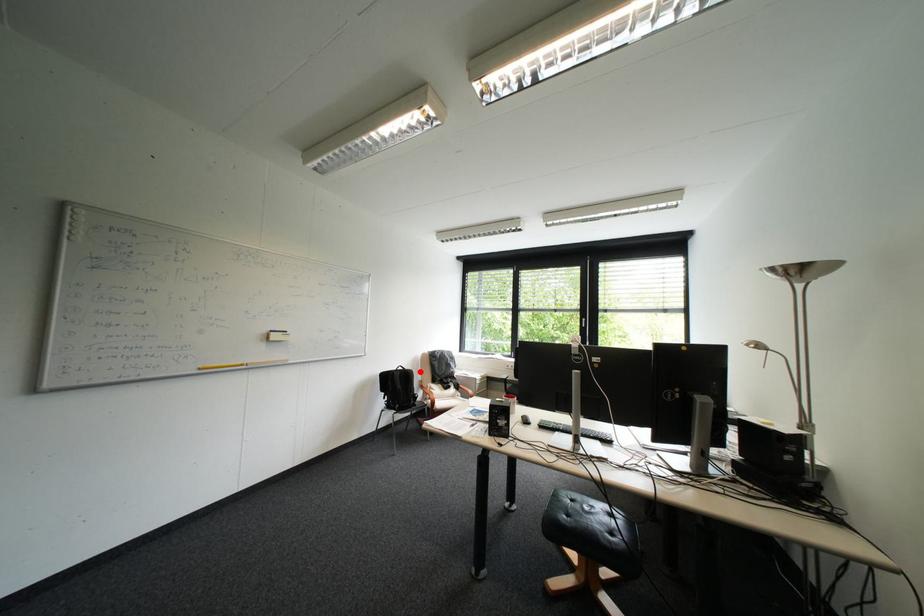
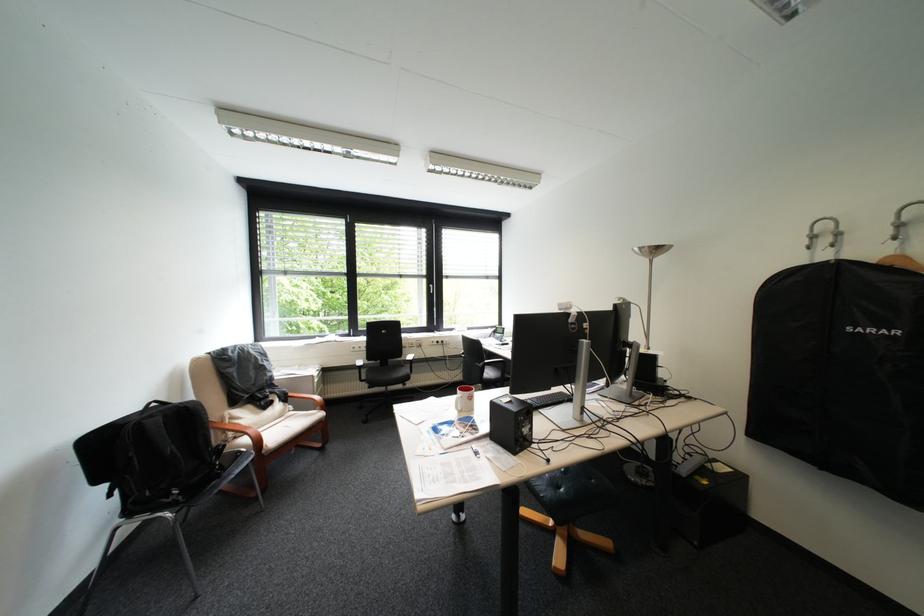
Question: A red point is marked in image1. In image2, is the corresponding 3D point closer to the camera or farther? Reply with the corresponding letter.

Choices:
 (A) The corresponding 3D point is closer.
 (B) The corresponding 3D point is farther.

Answer: (A)